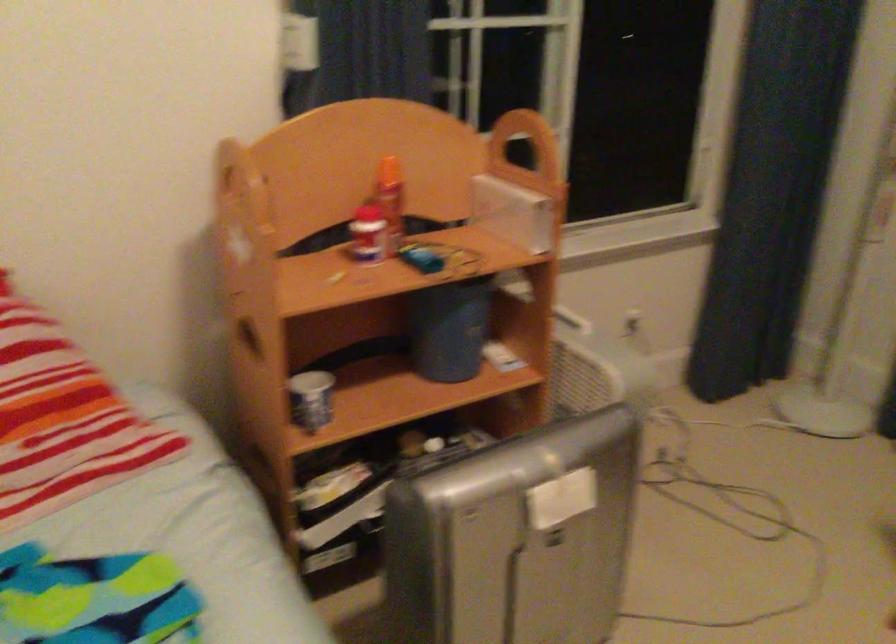
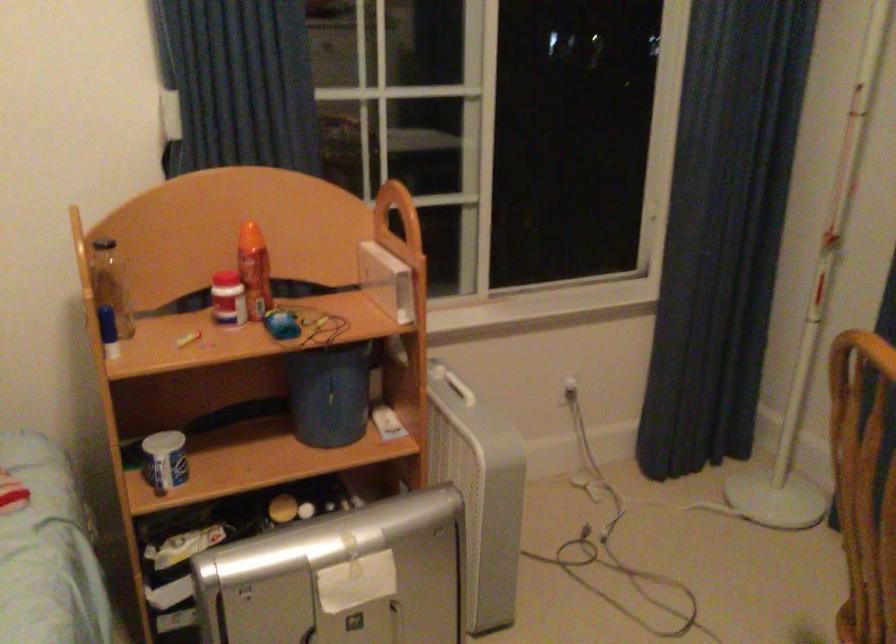
Locate, in the second image, the point that corresponds to the point at 388,204 in the first image.

(254, 270)